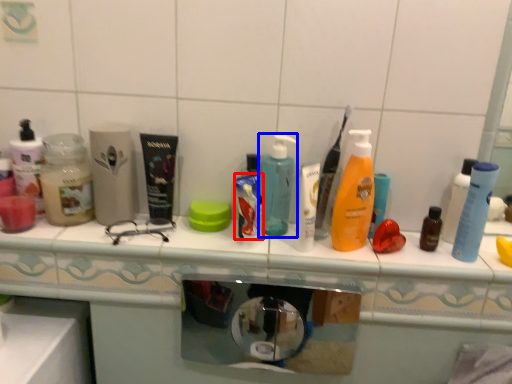
Question: Among these objects, which one is nearest to the camera, toothpaste (highlighted by a red box) or bottle (highlighted by a blue box)?

Choices:
 (A) toothpaste
 (B) bottle

Answer: (A)